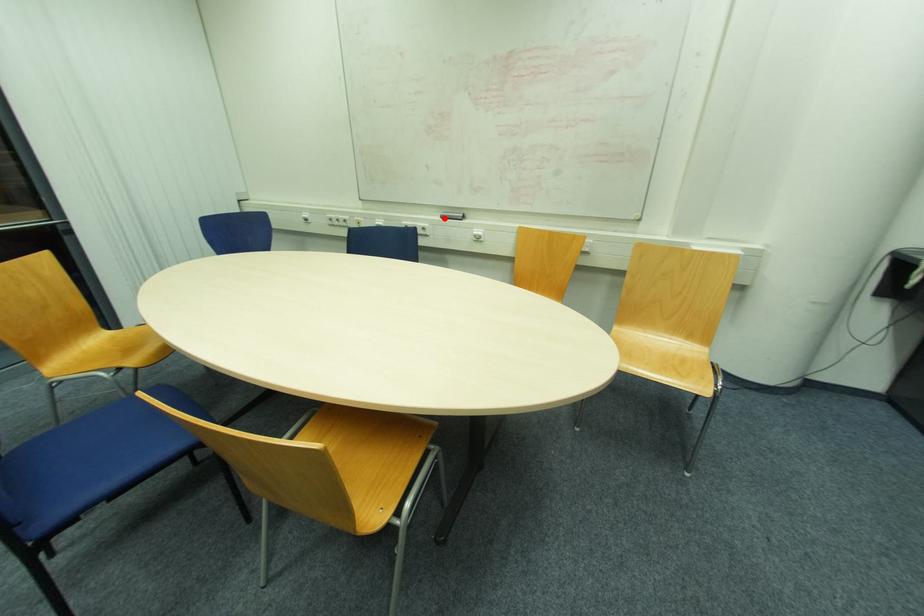
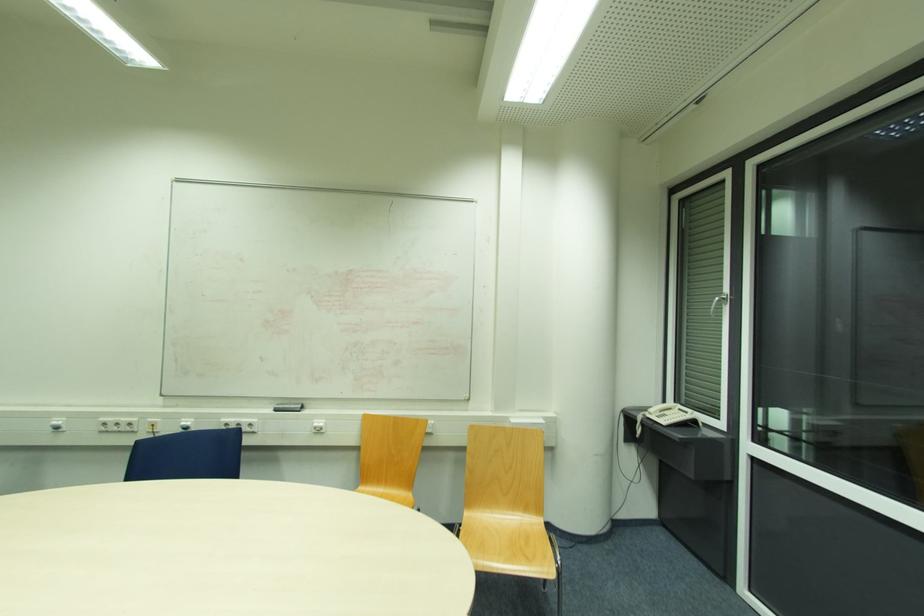
In the second image, find the point that corresponds to the highlighted location in the first image.

(276, 411)